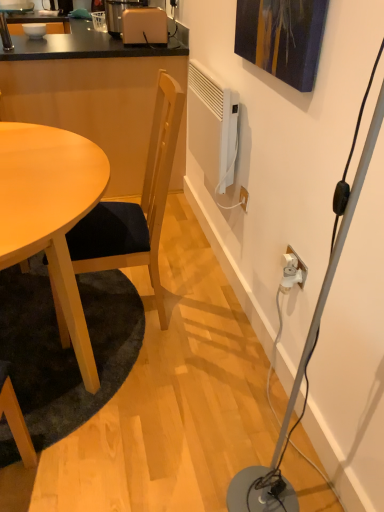
Question: Does white glossy bowl at upper left have a larger size compared to matte beige toaster at upper center?

Choices:
 (A) no
 (B) yes

Answer: (A)

Question: From a real-world perspective, is white glossy bowl at upper left below matte beige toaster at upper center?

Choices:
 (A) no
 (B) yes

Answer: (B)

Question: Does white glossy bowl at upper left have a lesser height compared to matte beige toaster at upper center?

Choices:
 (A) no
 (B) yes

Answer: (B)

Question: Does white glossy bowl at upper left have a smaller size compared to matte beige toaster at upper center?

Choices:
 (A) no
 (B) yes

Answer: (B)

Question: Could you tell me if white glossy bowl at upper left is facing matte beige toaster at upper center?

Choices:
 (A) no
 (B) yes

Answer: (A)

Question: Is white glossy bowl at upper left surrounding matte beige toaster at upper center?

Choices:
 (A) yes
 (B) no

Answer: (B)

Question: Is matte beige toaster at upper center not within beige plastic coffee machine at upper center?

Choices:
 (A) yes
 (B) no

Answer: (A)

Question: From the image's perspective, is matte beige toaster at upper center over beige plastic coffee machine at upper center?

Choices:
 (A) yes
 (B) no

Answer: (B)

Question: Could you tell me if matte beige toaster at upper center is facing beige plastic coffee machine at upper center?

Choices:
 (A) no
 (B) yes

Answer: (A)

Question: Is beige plastic coffee machine at upper center inside matte beige toaster at upper center?

Choices:
 (A) no
 (B) yes

Answer: (A)

Question: Is matte beige toaster at upper center in contact with beige plastic coffee machine at upper center?

Choices:
 (A) yes
 (B) no

Answer: (B)

Question: Is matte beige toaster at upper center facing away from beige plastic coffee machine at upper center?

Choices:
 (A) no
 (B) yes

Answer: (A)

Question: From a real-world perspective, is light brown wooden table at lower left beneath beige plastic coffee machine at upper center?

Choices:
 (A) no
 (B) yes

Answer: (B)